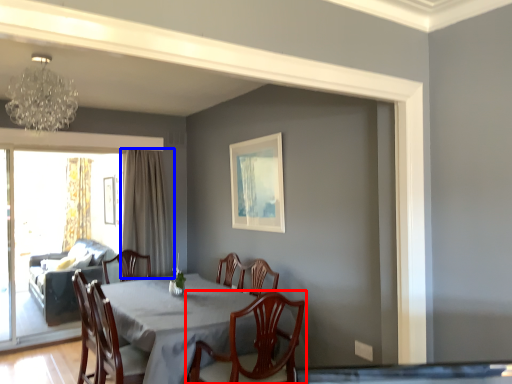
Question: Which point is further to the camera, chair (highlighted by a red box) or curtain (highlighted by a blue box)?

Choices:
 (A) chair
 (B) curtain

Answer: (B)